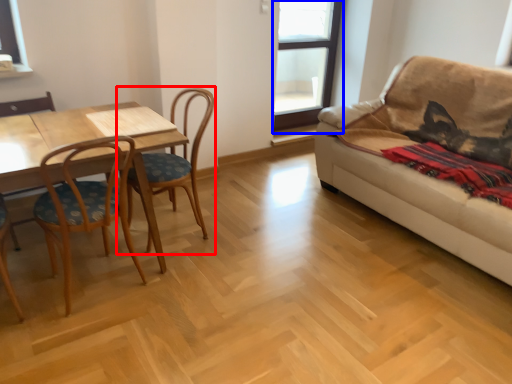
Question: Which object is closer to the camera taking this photo, chair (highlighted by a red box) or window (highlighted by a blue box)?

Choices:
 (A) chair
 (B) window

Answer: (A)